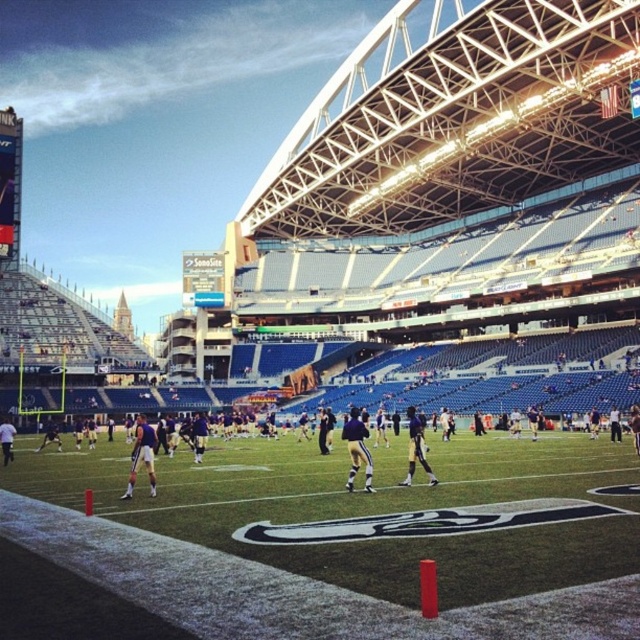
Measure the distance from green artificial turf at lower left to gold metallic uniform at center.

green artificial turf at lower left and gold metallic uniform at center are 3.92 feet apart from each other.

Who is lower down, green artificial turf at lower left or gold metallic uniform at center?

green artificial turf at lower left is below.

Is point (326, 577) in front of point (182, 518)?

Yes, it is in front of point (182, 518).

What are the coordinates of `green artificial turf at lower left` in the screenshot? It's located at tap(381, 509).